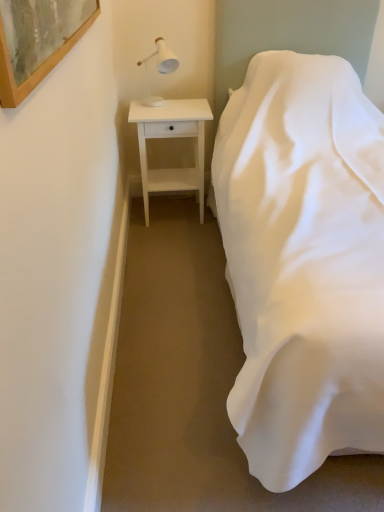
The image size is (384, 512). What are the coordinates of `empty space that is ontop of white wood nightstand at left (from a real-world perspective)` in the screenshot? It's located at (173, 105).